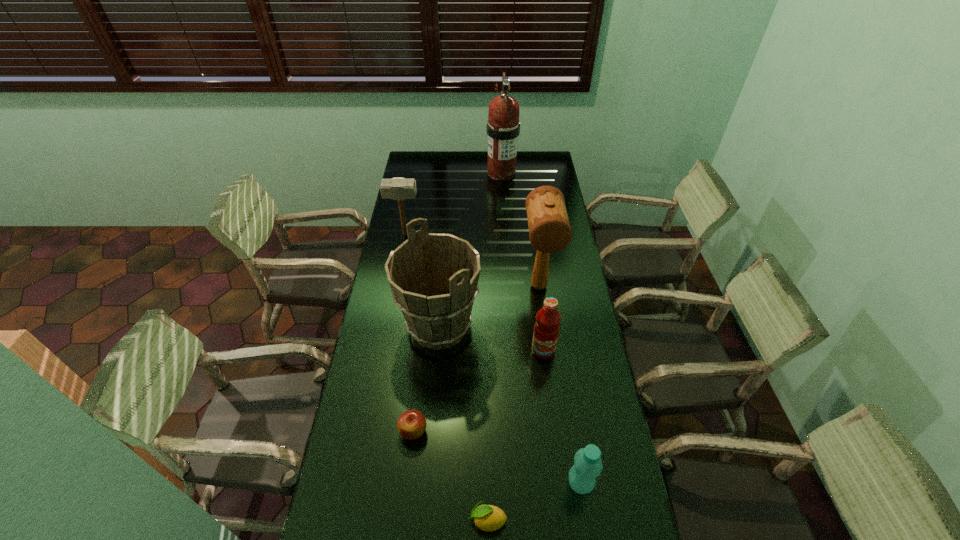
I want to click on vacant space at the far edge of the desktop, so click(454, 166).

Image resolution: width=960 pixels, height=540 pixels. In the image, there is a desktop. In order to click on vacant space at the left edge in this screenshot , I will do [x=366, y=536].

Locate an element on the screen. The width and height of the screenshot is (960, 540). vacant space at the right edge of the desktop is located at coordinates (581, 407).

Identify the location of vacant space at the far right corner of the desktop. The height and width of the screenshot is (540, 960). (544, 165).

At what (x,y) coordinates should I click in order to perform the action: click on vacant area that lies between the sixth tallest object and the bucket. Please return your answer as a coordinate pair (x, y). This screenshot has width=960, height=540. Looking at the image, I should click on (510, 405).

Identify the location of free space between the right mallet and the sixth tallest object. (560, 385).

This screenshot has width=960, height=540. Find the location of `free point between the fire extinguisher and the fruit juice`. free point between the fire extinguisher and the fruit juice is located at coordinates point(522,261).

This screenshot has height=540, width=960. What are the coordinates of `vacant area that lies between the shorter mallet and the farthest object` in the screenshot? It's located at (453, 203).

The width and height of the screenshot is (960, 540). I want to click on free space between the left mallet and the farthest object, so click(453, 203).

Find the location of a particular element. This screenshot has height=540, width=960. free space between the bucket and the fruit juice is located at coordinates point(492,339).